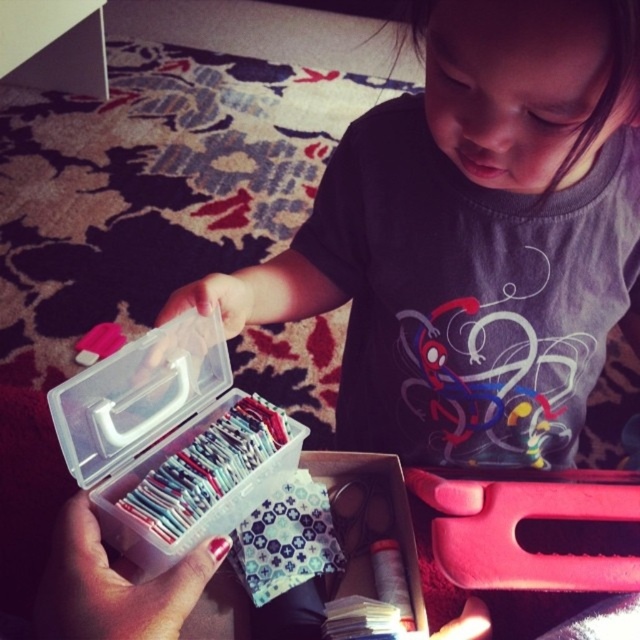
Question: Which point is farther to the camera?

Choices:
 (A) transparent plastic box at center
 (B) matte plastic girl at center

Answer: (A)

Question: In this image, where is matte plastic girl at center located relative to transparent plastic box at center?

Choices:
 (A) right
 (B) left

Answer: (A)

Question: Is matte plastic girl at center further to camera compared to transparent plastic box at center?

Choices:
 (A) no
 (B) yes

Answer: (A)

Question: Which point appears closest to the camera in this image?

Choices:
 (A) (396, 218)
 (B) (93, 390)

Answer: (B)

Question: Is matte plastic girl at center closer to the viewer compared to transparent plastic box at center?

Choices:
 (A) no
 (B) yes

Answer: (B)